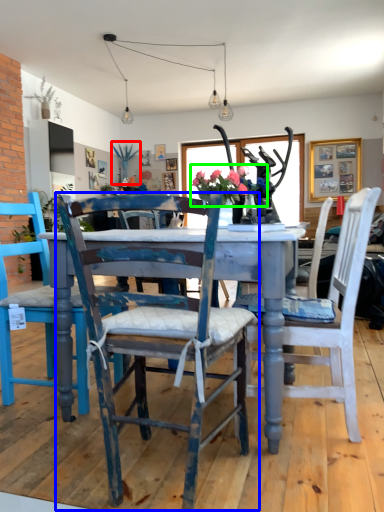
Question: Which object is positioned closest to plant (highlighted by a red box)? Select from chair (highlighted by a blue box) and floral arrangement (highlighted by a green box).

Choices:
 (A) chair
 (B) floral arrangement

Answer: (B)